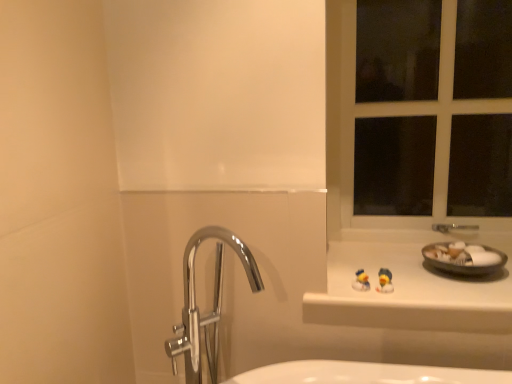
The height and width of the screenshot is (384, 512). In order to click on free space between yellow rubber duck at center, which appears as the second miniature when viewed from the left, and matte gray bowl at right in this screenshot , I will do `click(426, 285)`.